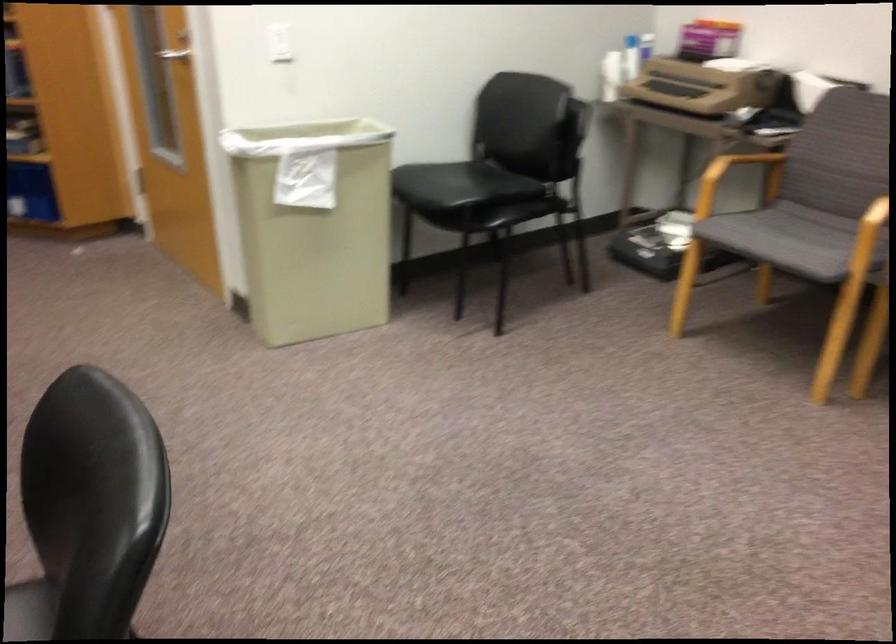
This screenshot has width=896, height=644. Describe the element at coordinates (174, 55) in the screenshot. I see `the silver door handle` at that location.